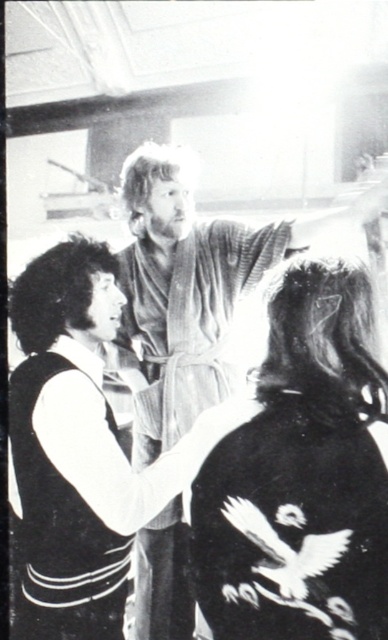
Question: In this image, where is dark textured hair at center located relative to curly hair at center?

Choices:
 (A) below
 (B) above

Answer: (A)

Question: Can you confirm if textured cotton robe at center is bigger than striped fabric robe at center?

Choices:
 (A) no
 (B) yes

Answer: (B)

Question: Among these objects, which one is farthest from the camera?

Choices:
 (A) striped fabric robe at center
 (B) dark textured hair at center
 (C) curly hair at left
 (D) curly hair at center

Answer: (D)

Question: Which of the following is the farthest from the observer?

Choices:
 (A) 318,385
 (B) 287,602
 (C) 76,628

Answer: (C)

Question: Which of the following is the closest to the observer?

Choices:
 (A) curly hair at center
 (B) textured cotton robe at center
 (C) curly hair at left

Answer: (C)

Question: Is textured cotton robe at center to the right of curly hair at center from the viewer's perspective?

Choices:
 (A) yes
 (B) no

Answer: (A)